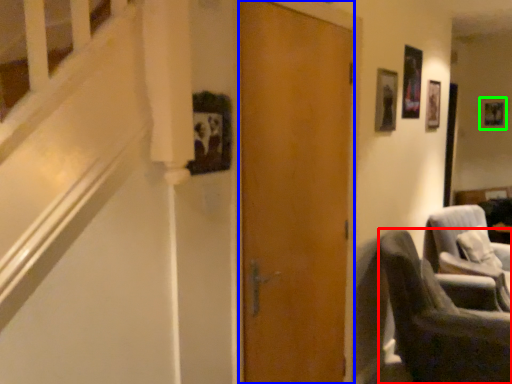
Question: Based on their relative distances, which object is nearer to chair (highlighted by a red box)? Choose from door (highlighted by a blue box) and picture frame (highlighted by a green box).

Choices:
 (A) door
 (B) picture frame

Answer: (A)